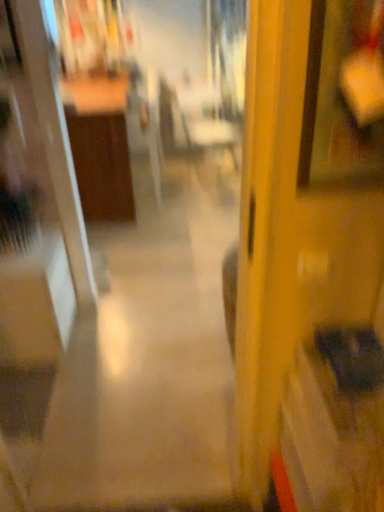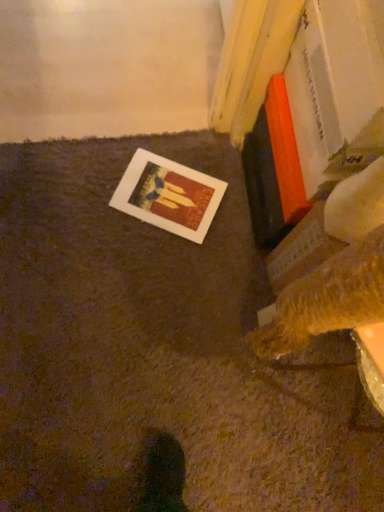
Question: Which way did the camera rotate in the video?

Choices:
 (A) rotated upward
 (B) rotated downward

Answer: (B)